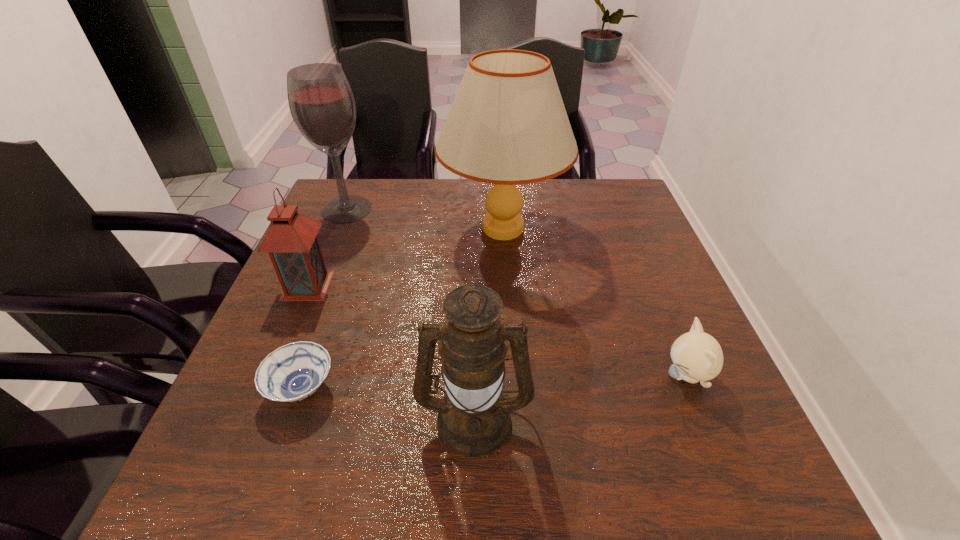
You are a GUI agent. You are given a task and a screenshot of the screen. Output one action in this format:
    pyautogui.click(x=<x>, y=<y>)
    Task: Click on the free location that satisfies the following two spatial constraints: 1. on the back side of the third farthest object; 2. on the right side of the lampshade
    The height and width of the screenshot is (540, 960).
    Given the screenshot: What is the action you would take?
    pyautogui.click(x=332, y=228)

What are the coordinates of `vacant space that satisfies the following two spatial constraints: 1. on the face of the kitten; 2. on the front side of the shortest object` in the screenshot? It's located at (692, 388).